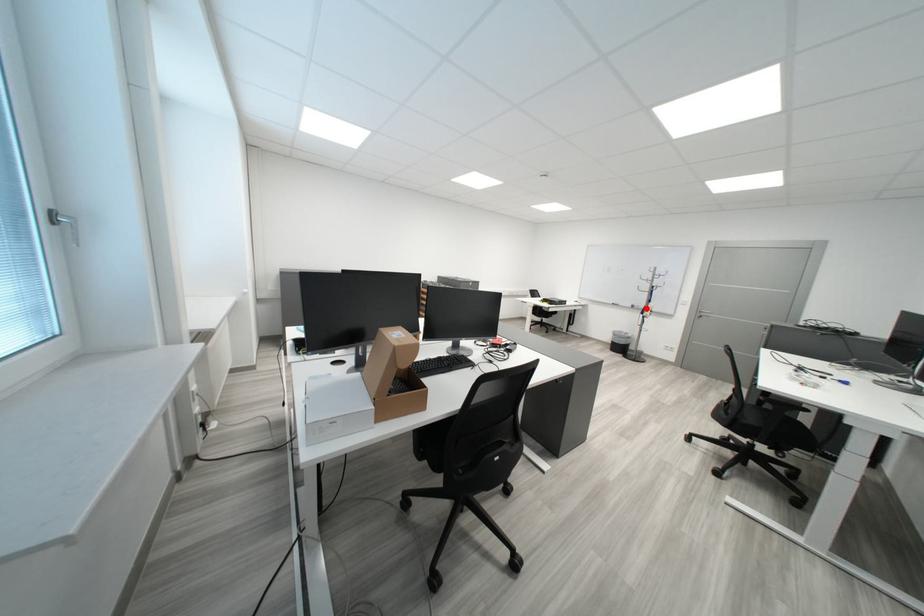
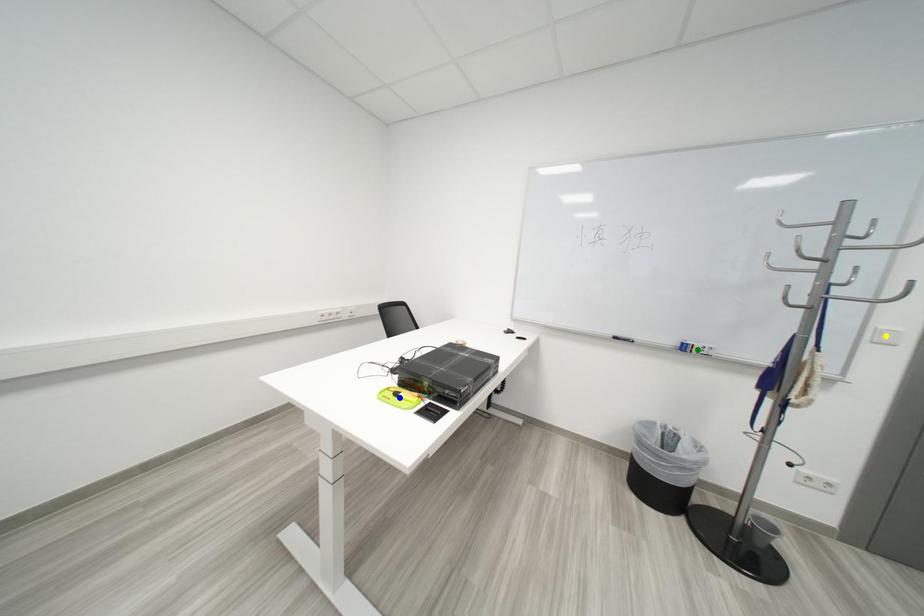
Question: I am providing you with two images of the same scene from different viewpoints. A red point is marked on the first image. You are given multiple points on the second image. Can you choose the point in image 2 that corresponds to the point in image 1?

Choices:
 (A) yellow point
 (B) green point
 (C) blue point

Answer: (B)